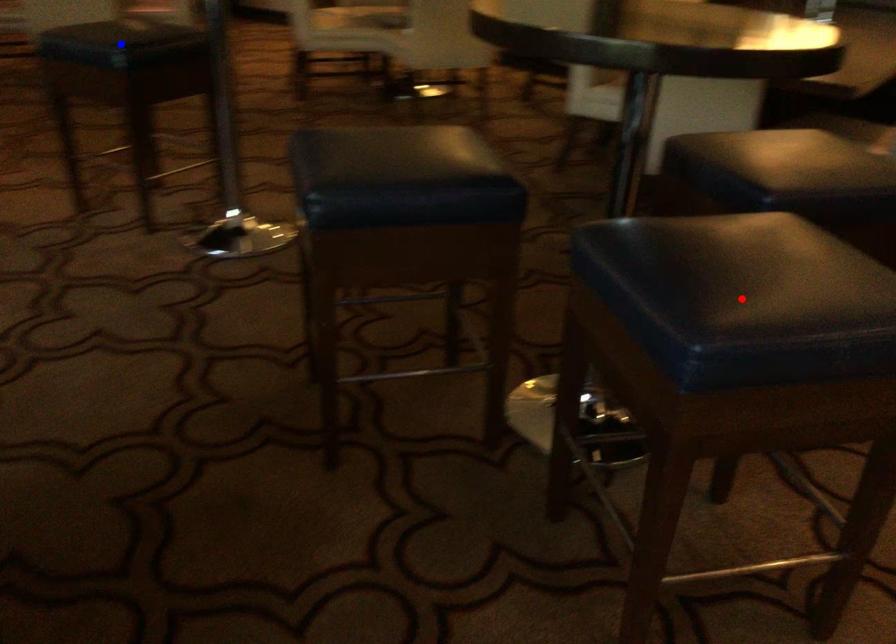
Question: Two points are marked on the image. Which point is closer to the camera?

Choices:
 (A) Blue point is closer.
 (B) Red point is closer.

Answer: (B)